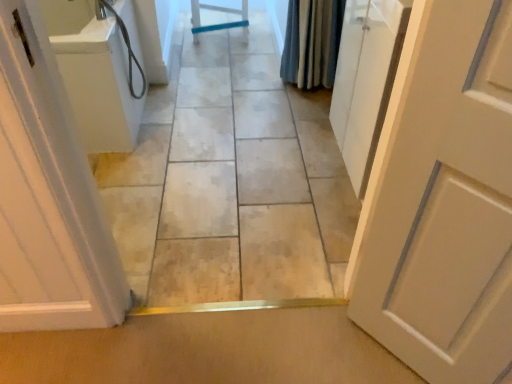
Question: Considering the positions of white matte door at right, arranged as the 2th door when viewed from the left, and blue textured fabric shower curtain at upper right in the image, is white matte door at right, arranged as the 2th door when viewed from the left, taller or shorter than blue textured fabric shower curtain at upper right?

Choices:
 (A) tall
 (B) short

Answer: (A)

Question: Considering the positions of point (496, 258) and point (326, 77), is point (496, 258) closer or farther from the camera than point (326, 77)?

Choices:
 (A) farther
 (B) closer

Answer: (B)

Question: Considering the real-world distances, which object is farthest from the blue textured fabric shower curtain at upper right?

Choices:
 (A) white matte door at right, arranged as the 2th door when viewed from the left
 (B) smooth tile floor at center
 (C) white glossy door at left, which ranks as the first door in left-to-right order

Answer: (C)

Question: Estimate the real-world distances between objects in this image. Which object is farther from the white glossy door at left, which ranks as the first door in left-to-right order?

Choices:
 (A) white matte door at right, the first door viewed from the right
 (B) smooth tile floor at center
 (C) blue textured fabric shower curtain at upper right

Answer: (C)